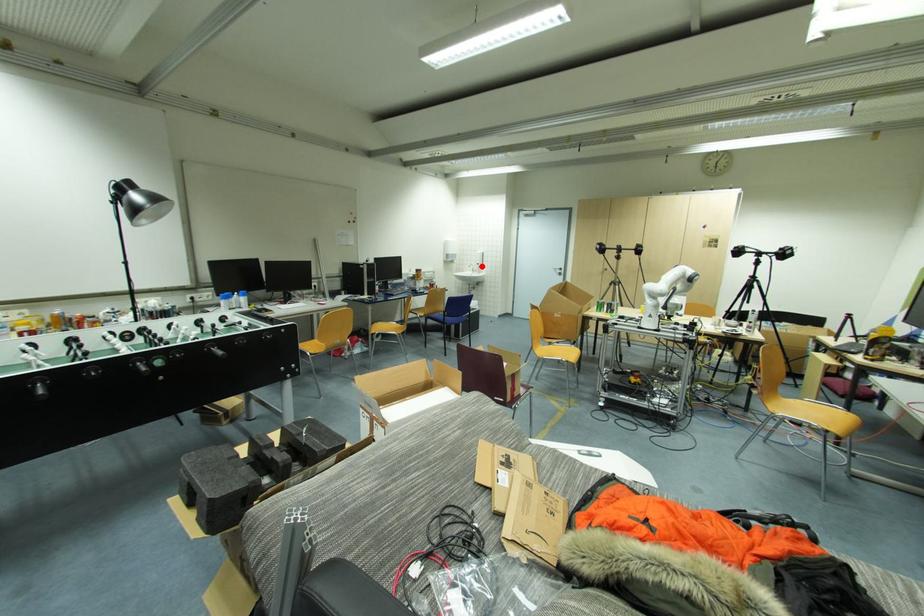
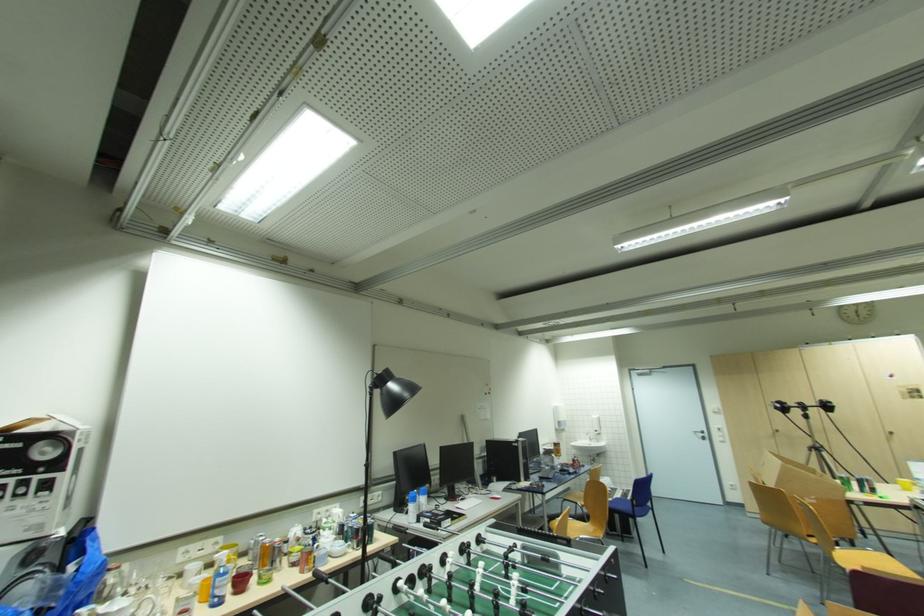
The point at the highlighted location is marked in the first image. Where is the corresponding point in the second image?

(601, 434)